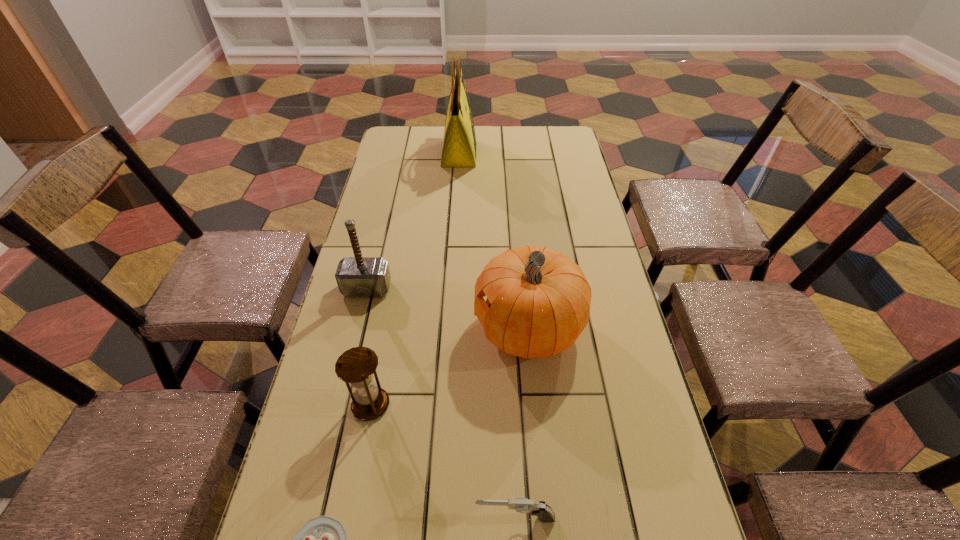
The width and height of the screenshot is (960, 540). In order to click on free space located 0.210m on the front-facing side of the pumpkin in this screenshot , I will do `click(394, 329)`.

Locate an element on the screen. free spot located 0.370m on the back of the hammer is located at coordinates (388, 201).

Locate an element on the screen. Image resolution: width=960 pixels, height=540 pixels. vacant space located on the front of the fourth tallest object is located at coordinates (361, 460).

At what (x,y) coordinates should I click in order to perform the action: click on vacant region located at the muzzle of the second shortest object. Please return your answer as a coordinate pair (x, y). The width and height of the screenshot is (960, 540). Looking at the image, I should click on (439, 517).

Where is `vacant space located 0.300m at the muzzle of the second shortest object`? This screenshot has width=960, height=540. vacant space located 0.300m at the muzzle of the second shortest object is located at coordinates (317, 517).

Where is `vacant space located 0.150m at the muzzle of the second shortest object`? The height and width of the screenshot is (540, 960). vacant space located 0.150m at the muzzle of the second shortest object is located at coordinates (396, 517).

Where is `object that is at the far edge`? Image resolution: width=960 pixels, height=540 pixels. object that is at the far edge is located at coordinates (459, 143).

This screenshot has height=540, width=960. Find the location of `hammer that is at the left edge`. hammer that is at the left edge is located at coordinates (357, 276).

Where is `hourglass that is at the left edge`? hourglass that is at the left edge is located at coordinates pos(356,366).

Where is `object positioned at the right edge`? This screenshot has height=540, width=960. object positioned at the right edge is located at coordinates (538, 301).